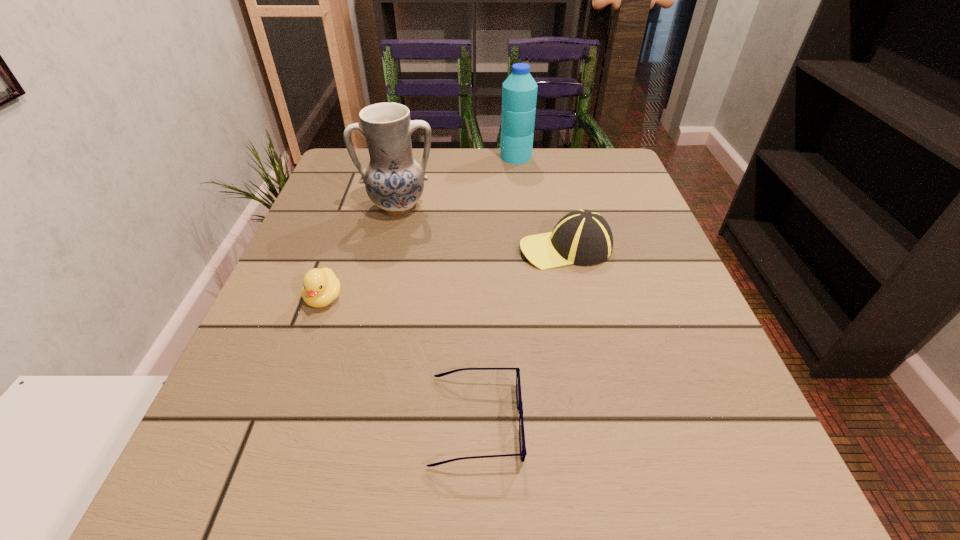
What are the coordinates of `vacant space located with the brim of the baseball cap facing forward` in the screenshot? It's located at (375, 248).

I want to click on vacant space located 0.240m on the beak of the fourth farthest object, so click(x=269, y=451).

Find the location of a particular element. The height and width of the screenshot is (540, 960). free point located 0.220m on the front-facing side of the spectacles is located at coordinates (680, 421).

Image resolution: width=960 pixels, height=540 pixels. What are the coordinates of `water bottle present at the far edge` in the screenshot? It's located at (519, 91).

At what (x,y) coordinates should I click in order to perform the action: click on pottery located at the far edge. Please return your answer as a coordinate pair (x, y). Looking at the image, I should click on (394, 181).

Where is `object at the near edge`? object at the near edge is located at coordinates (523, 452).

Locate an element on the screen. This screenshot has height=540, width=960. pottery that is at the left edge is located at coordinates (394, 181).

You are a GUI agent. You are given a task and a screenshot of the screen. Output one action in this format:
    pyautogui.click(x=<x>, y=<y>)
    Task: Click on the duckling at the left edge
    The height and width of the screenshot is (540, 960).
    Given the screenshot: What is the action you would take?
    [x=321, y=287]

I want to click on object present at the right edge, so click(583, 237).

You are a GUI agent. You are given a task and a screenshot of the screen. Output one action in this format:
    pyautogui.click(x=<x>, y=<y>)
    Task: Click on the object located at the far left corner
    
    Given the screenshot: What is the action you would take?
    point(394,181)